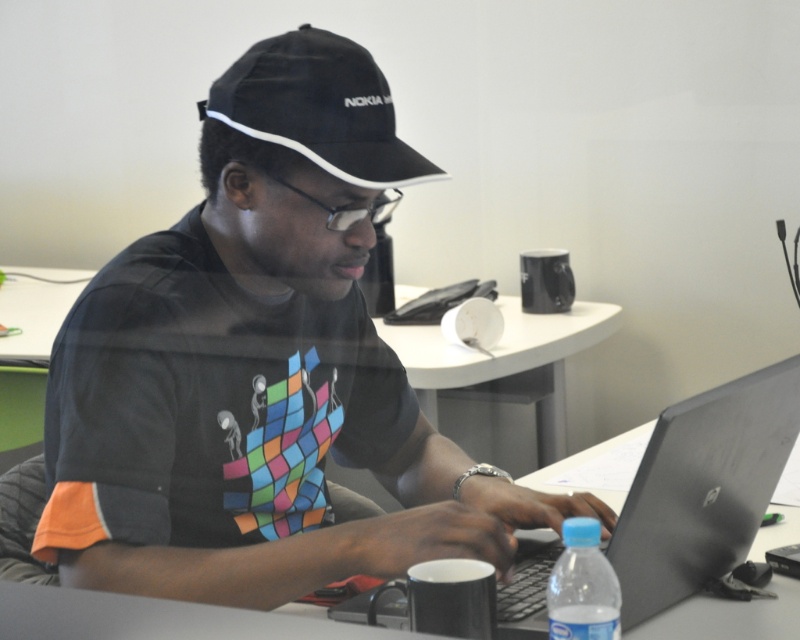
Can you confirm if matte black cap at upper center is smaller than silver metallic laptop at center?

No, matte black cap at upper center is not smaller than silver metallic laptop at center.

Which is below, matte black cap at upper center or silver metallic laptop at center?

Positioned lower is silver metallic laptop at center.

Describe the element at coordinates (262, 368) in the screenshot. The height and width of the screenshot is (640, 800). I see `matte black cap at upper center` at that location.

Find the location of `matte black cap at upper center`. matte black cap at upper center is located at coordinates (262, 368).

The width and height of the screenshot is (800, 640). What do you see at coordinates (318, 108) in the screenshot?
I see `black fabric baseball hat at upper center` at bounding box center [318, 108].

Who is taller, black fabric baseball hat at upper center or clear plastic bottle at lower center?

black fabric baseball hat at upper center is taller.

Image resolution: width=800 pixels, height=640 pixels. Identify the location of black fabric baseball hat at upper center. (318, 108).

Is silver metallic laptop at center to the right of black fabric baseball hat at upper center from the viewer's perspective?

Correct, you'll find silver metallic laptop at center to the right of black fabric baseball hat at upper center.

Can you confirm if silver metallic laptop at center is positioned above black fabric baseball hat at upper center?

No, silver metallic laptop at center is not above black fabric baseball hat at upper center.

Identify the location of silver metallic laptop at center. (702, 488).

Find the location of a particular element. This screenshot has height=640, width=800. silver metallic laptop at center is located at coordinates (702, 488).